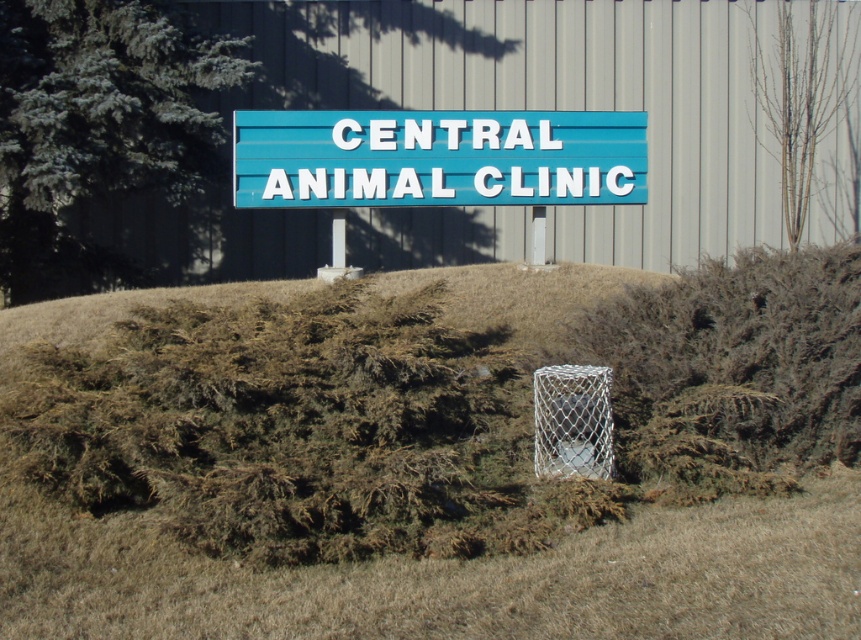
Image resolution: width=861 pixels, height=640 pixels. I want to click on blue plastic sign at center, so click(x=437, y=157).

Looking at this image, who is positioned more to the left, blue plastic sign at center or white mesh basketball hoop at center?

blue plastic sign at center

In order to click on blue plastic sign at center in this screenshot , I will do `click(437, 157)`.